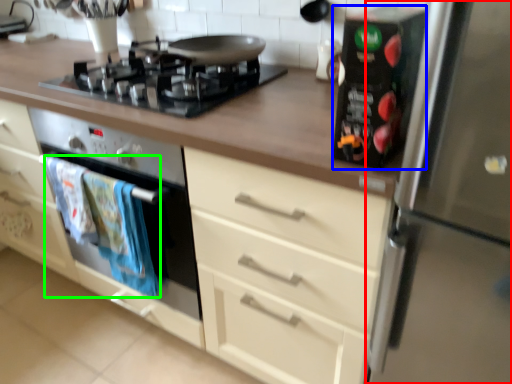
Question: Which object is the closest to the refrigerator (highlighted by a red box)? Choose among these: appliance (highlighted by a blue box) or material (highlighted by a green box).

Choices:
 (A) appliance
 (B) material

Answer: (A)